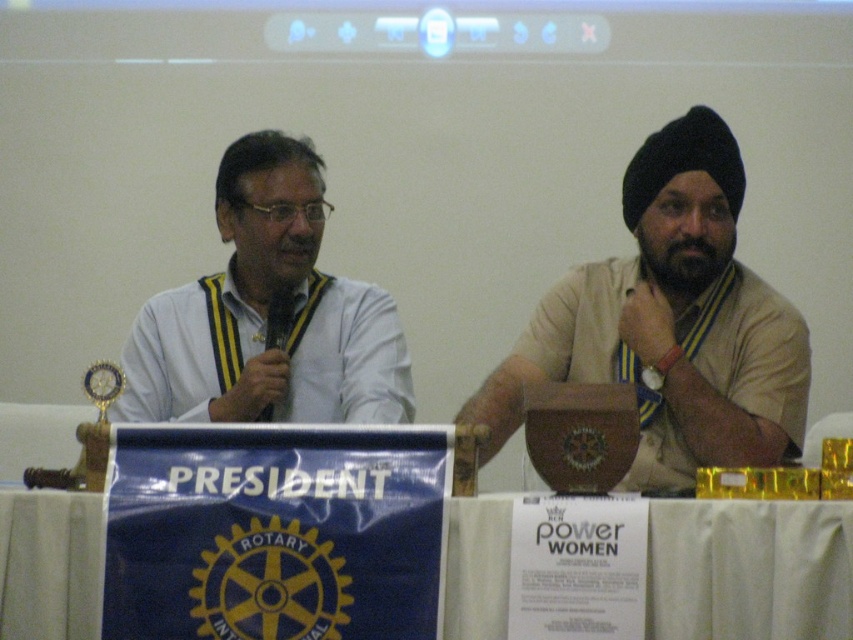
You are a photographer at a formal event. You want to capture a clear photo of the white matte shirt at left without the white cloth at lower center blocking it. What should you do?

Move the camera angle upward so that the white cloth at lower center is no longer in front of the white matte shirt at left.

You are a photographer at the event and need to capture a photo where both the white cloth at lower center and the white matte shirt at left are visible. Based on their positions, which object should be positioned to the right side of the frame to ensure both are included?

The white cloth at lower center should be positioned to the right side of the frame because it is already to the right of the white matte shirt at left, ensuring both are visible when framed this way.

You are a photographer at this event and need to ensure that the white cloth at lower center and the white matte shirt at left are both visible in the photo. Given their sizes, which one might you need to adjust your camera angle to better capture?

The white cloth at lower center is shorter than the white matte shirt at left, so you might need to adjust your camera angle to ensure the shorter white cloth at lower center is fully visible in the photo.